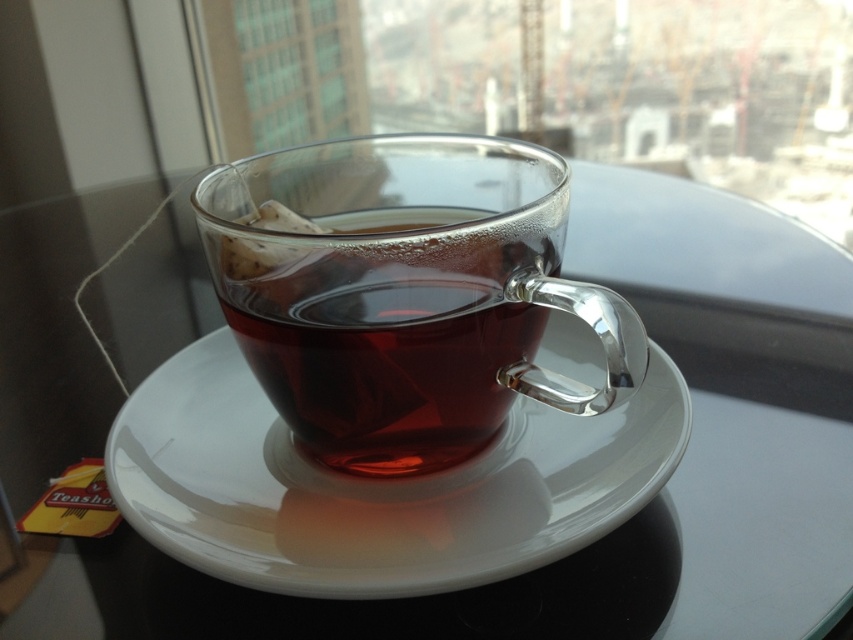
Between white glossy saucer at center and transparent glass cup at center, which one appears on the right side from the viewer's perspective?

white glossy saucer at center

Does point (328, 508) lie behind point (384, 435)?

Yes, point (328, 508) is behind point (384, 435).

Where is `white glossy saucer at center`? This screenshot has height=640, width=853. white glossy saucer at center is located at coordinates (375, 484).

Locate an element on the screen. This screenshot has height=640, width=853. white glossy saucer at center is located at coordinates (375, 484).